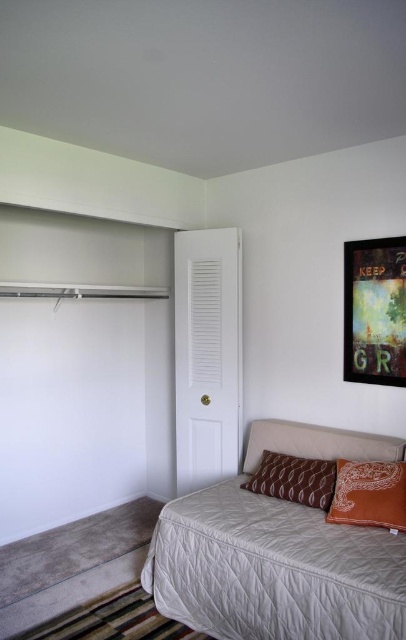
Does beige quilted bed at lower right have a greater width compared to brown textured pillow at lower right?

Indeed, beige quilted bed at lower right has a greater width compared to brown textured pillow at lower right.

Does beige quilted bed at lower right have a larger size compared to brown textured pillow at lower right?

Yes, beige quilted bed at lower right is bigger than brown textured pillow at lower right.

What do you see at coordinates (278, 552) in the screenshot? I see `beige quilted bed at lower right` at bounding box center [278, 552].

This screenshot has height=640, width=406. Identify the location of beige quilted bed at lower right. (278, 552).

Is beige quilted bed at lower right bigger than brown patterned pillow at center?

Indeed, beige quilted bed at lower right has a larger size compared to brown patterned pillow at center.

Is beige quilted bed at lower right above brown patterned pillow at center?

Actually, beige quilted bed at lower right is below brown patterned pillow at center.

Which is behind, point (269, 554) or point (263, 486)?

Positioned behind is point (263, 486).

The image size is (406, 640). I want to click on beige quilted bed at lower right, so [x=278, y=552].

Does metallic framed artwork at upper right have a lesser width compared to brown patterned pillow at center?

Yes, metallic framed artwork at upper right is thinner than brown patterned pillow at center.

Does point (403, 308) come behind point (280, 481)?

No, it is in front of (280, 481).

Locate an element on the screen. The image size is (406, 640). metallic framed artwork at upper right is located at coordinates (375, 310).